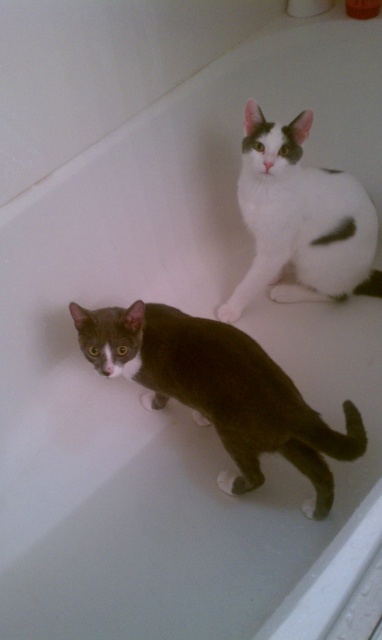
You are a photographer trying to capture the two cats in the bathtub. You notice two points marked in the image. Which point is closer to you, point (362, 438) or point (249, 192)?

Point (362, 438) is closer to the viewer than point (249, 192).

You are a photographer trying to capture both cats in the bathtub. Since the dark gray fur cat at lower center is to the left of the white matte fur cat at upper right, which cat should you focus on first if you want to frame them from left to right?

You should focus on the dark gray fur cat at lower center first because it is positioned to the left of the white matte fur cat at upper right, aligning with the left to right framing.

You need to decide which cat is easier to see from the bathroom door. Consider the positions of the dark gray fur cat at lower center and the white matte fur cat at upper right. Which cat is closer to the camera?

The dark gray fur cat at lower center is closer to the camera than the white matte fur cat at upper right.